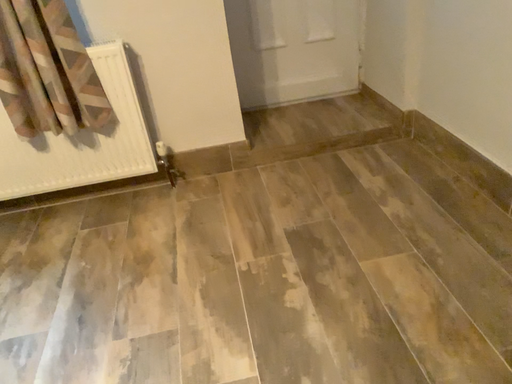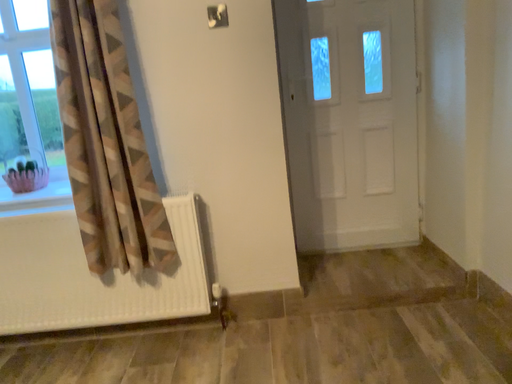
Question: Which way did the camera rotate in the video?

Choices:
 (A) rotated left
 (B) rotated right

Answer: (A)